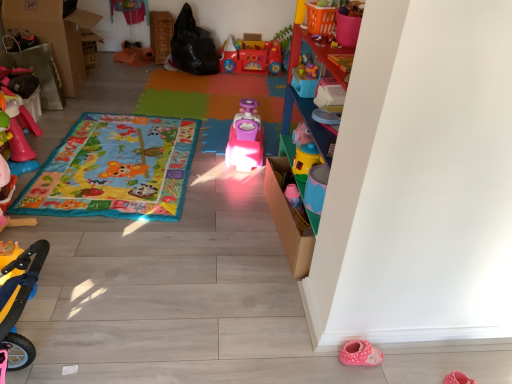
I want to click on vacant area on the back side of yellow plastic scooter at lower left, the fourth toy positioned from the left, so 66,264.